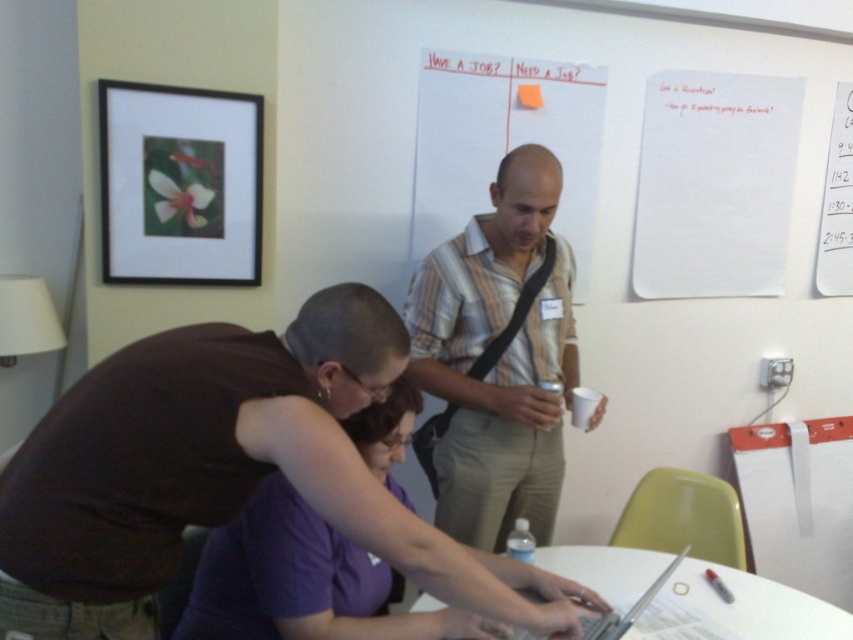
Is striped cotton shirt at center to the left of black matte picture frame at upper left from the viewer's perspective?

Incorrect, striped cotton shirt at center is not on the left side of black matte picture frame at upper left.

Which is more to the left, striped cotton shirt at center or black matte picture frame at upper left?

black matte picture frame at upper left is more to the left.

I want to click on striped cotton shirt at center, so [498, 356].

From the picture: Is black matte picture frame at upper left thinner than white glossy table at center?

Yes, black matte picture frame at upper left is thinner than white glossy table at center.

Who is lower down, black matte picture frame at upper left or white glossy table at center?

white glossy table at center

The width and height of the screenshot is (853, 640). Identify the location of black matte picture frame at upper left. (178, 184).

I want to click on black matte picture frame at upper left, so click(178, 184).

How far apart are purple matte shirt at center and black matte picture frame at upper left?

A distance of 38.49 inches exists between purple matte shirt at center and black matte picture frame at upper left.

Is purple matte shirt at center positioned at the back of black matte picture frame at upper left?

No, purple matte shirt at center is in front of black matte picture frame at upper left.

Describe the element at coordinates (302, 582) in the screenshot. Image resolution: width=853 pixels, height=640 pixels. I see `purple matte shirt at center` at that location.

Find the location of a particular element. Image resolution: width=853 pixels, height=640 pixels. purple matte shirt at center is located at coordinates (302, 582).